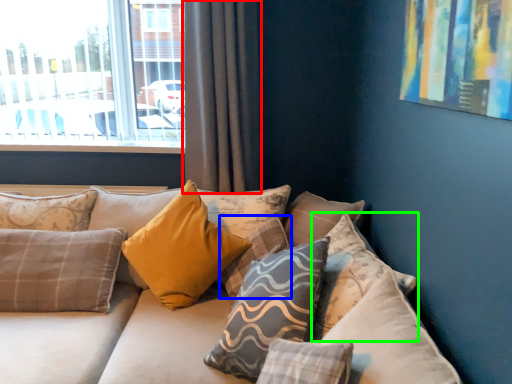
Question: Which is farther away from curtain (highlighted by a red box)? pillow (highlighted by a blue box) or pillow (highlighted by a green box)?

Choices:
 (A) pillow
 (B) pillow

Answer: (B)